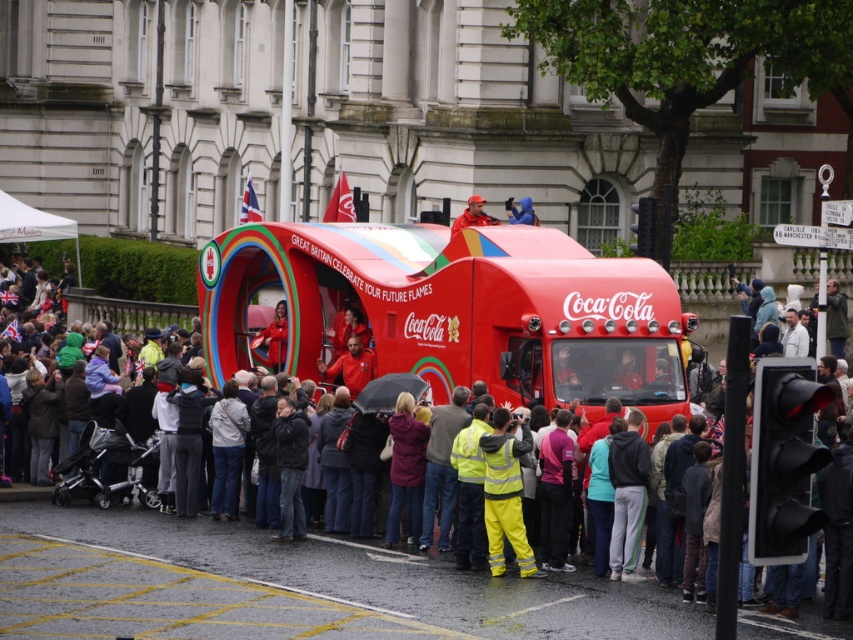
Question: Can you confirm if matte red truck at center is positioned to the left of matte red cap at center?

Choices:
 (A) no
 (B) yes

Answer: (B)

Question: Can you confirm if high visibility yellow jacket at center is smaller than matte red truck at center?

Choices:
 (A) no
 (B) yes

Answer: (B)

Question: Which object appears farthest from the camera in this image?

Choices:
 (A) high visibility yellow jacket at center
 (B) blue fabric jacket at center
 (C) shiny red coca-cola truck at center
 (D) matte red truck at center

Answer: (B)

Question: Based on their relative distances, which object is farther from the high visibility yellow jacket at center?

Choices:
 (A) matte red cap at center
 (B) blue fabric jacket at center

Answer: (B)

Question: Is shiny red coca-cola truck at center to the left of matte red cap at center from the viewer's perspective?

Choices:
 (A) no
 (B) yes

Answer: (B)

Question: Which object is closer to the camera taking this photo?

Choices:
 (A) high visibility yellow jacket at center
 (B) shiny red coca-cola truck at center

Answer: (A)